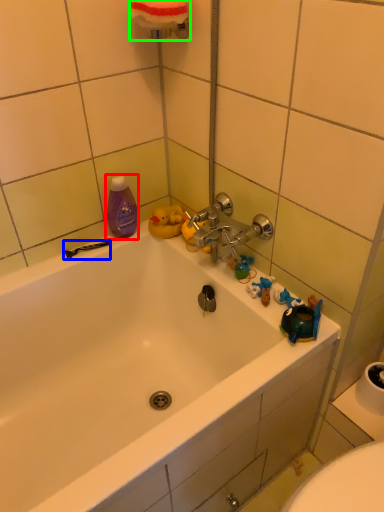
Question: Which object is the closest to the mouthwash (highlighted by a red box)? Choose among these: shower (highlighted by a blue box) or towel bar (highlighted by a green box).

Choices:
 (A) shower
 (B) towel bar

Answer: (A)